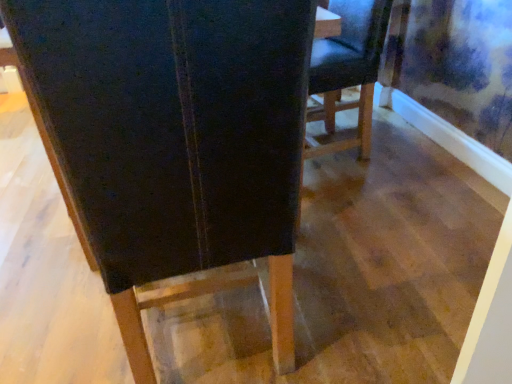
Question: Considering the relative positions of matte black chair at center, which is counted as the 2th chair, starting from the left, and black leather chair at center, the 2th chair positioned from the right, in the image provided, is matte black chair at center, which is counted as the 2th chair, starting from the left, to the left of black leather chair at center, the 2th chair positioned from the right, from the viewer's perspective?

Choices:
 (A) no
 (B) yes

Answer: (A)

Question: Does matte black chair at center, arranged as the first chair when viewed from the back, have a larger size compared to black leather chair at center, which appears as the first chair when viewed from the left?

Choices:
 (A) no
 (B) yes

Answer: (A)

Question: Could black leather chair at center, which ranks as the 1th chair in front-to-back order, be considered to be inside matte black chair at center, which is the 2th chair from front to back?

Choices:
 (A) no
 (B) yes

Answer: (A)

Question: Does matte black chair at center, arranged as the first chair when viewed from the back, lie behind black leather chair at center, arranged as the second chair when viewed from the back?

Choices:
 (A) yes
 (B) no

Answer: (A)

Question: Does matte black chair at center, the first chair viewed from the right, appear on the right side of black leather chair at center, arranged as the second chair when viewed from the back?

Choices:
 (A) yes
 (B) no

Answer: (A)

Question: Does matte black chair at center, arranged as the first chair when viewed from the back, come in front of black leather chair at center, which ranks as the 1th chair in front-to-back order?

Choices:
 (A) no
 (B) yes

Answer: (A)

Question: From a real-world perspective, is black leather chair at center, which appears as the first chair when viewed from the left, positioned over matte black chair at center, arranged as the first chair when viewed from the back, based on gravity?

Choices:
 (A) yes
 (B) no

Answer: (A)

Question: Is black leather chair at center, the 2th chair positioned from the right, to the right of matte black chair at center, arranged as the first chair when viewed from the back, from the viewer's perspective?

Choices:
 (A) yes
 (B) no

Answer: (B)

Question: Is the position of black leather chair at center, arranged as the second chair when viewed from the back, more distant than that of matte black chair at center, the first chair viewed from the right?

Choices:
 (A) yes
 (B) no

Answer: (B)

Question: Is black leather chair at center, which appears as the first chair when viewed from the left, surrounding matte black chair at center, which is counted as the 2th chair, starting from the left?

Choices:
 (A) no
 (B) yes

Answer: (A)

Question: Is black leather chair at center, the 2th chair positioned from the right, at the left side of matte black chair at center, which is the 2th chair from front to back?

Choices:
 (A) no
 (B) yes

Answer: (B)

Question: From the image's perspective, is black leather chair at center, which ranks as the 1th chair in front-to-back order, below matte black chair at center, which is the 2th chair from front to back?

Choices:
 (A) no
 (B) yes

Answer: (B)

Question: Is matte black chair at center, which is the 2th chair from front to back, taller or shorter than black leather chair at center, which appears as the first chair when viewed from the left?

Choices:
 (A) tall
 (B) short

Answer: (B)